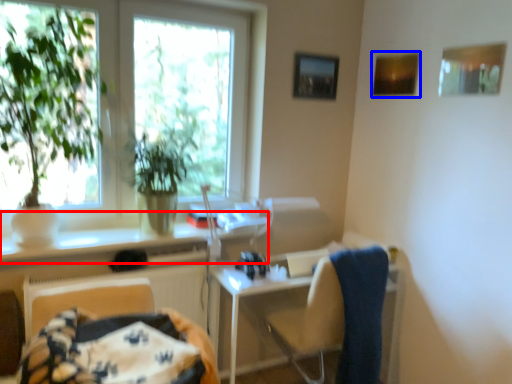
Question: Which point is closer to the camera, counter top (highlighted by a red box) or picture frame (highlighted by a blue box)?

Choices:
 (A) counter top
 (B) picture frame

Answer: (A)